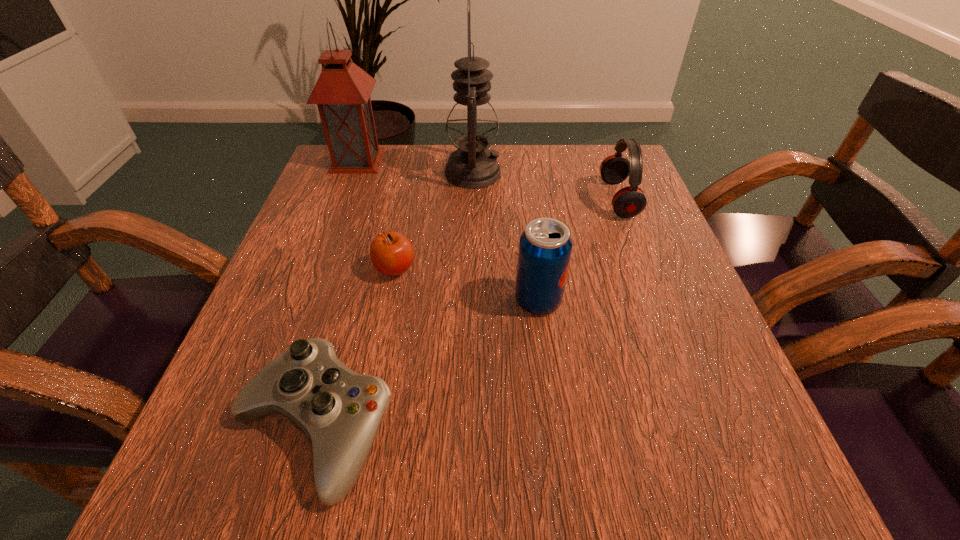
The width and height of the screenshot is (960, 540). Identify the location of unoccupied area between the oil lamp and the control. (394, 300).

The height and width of the screenshot is (540, 960). What are the coordinates of `object that ranks as the fourth closest to the nearest object` in the screenshot? It's located at (628, 202).

Select which object appears as the closest to the control. Please provide its 2D coordinates. Your answer should be formatted as a tuple, i.e. [(x, y)], where the tuple contains the x and y coordinates of a point satisfying the conditions above.

[(391, 253)]

Image resolution: width=960 pixels, height=540 pixels. Find the location of `blank space that satisfies the following two spatial constraints: 1. on the front side of the apple; 2. on the left side of the second tallest object`. blank space that satisfies the following two spatial constraints: 1. on the front side of the apple; 2. on the left side of the second tallest object is located at coordinates (316, 269).